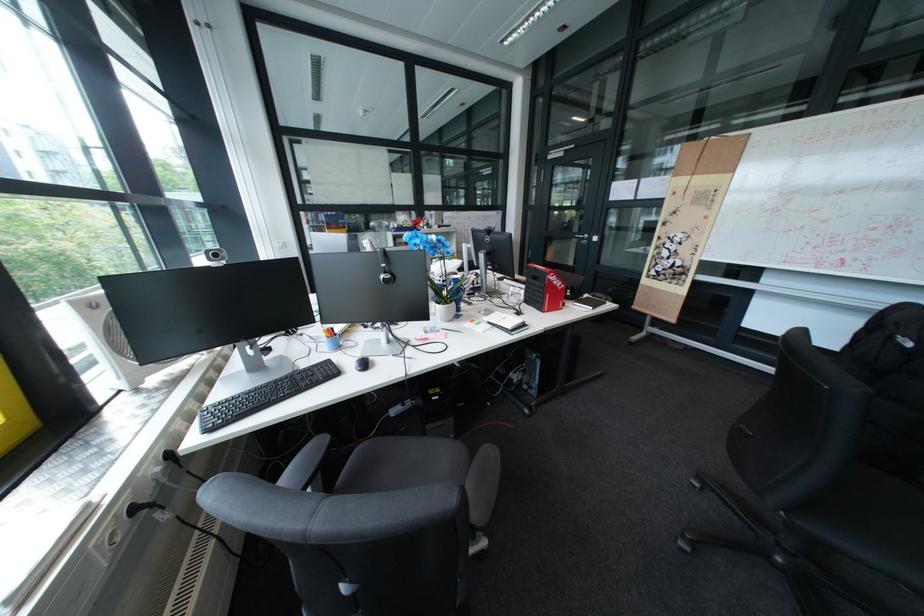
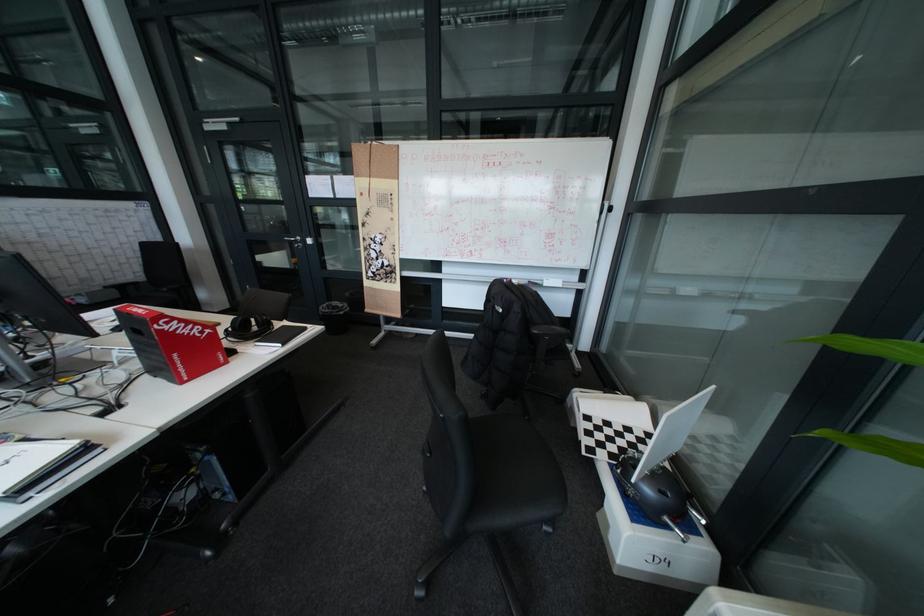
In the second image, find the point that corresponds to (x=538, y=304) in the first image.

(160, 376)